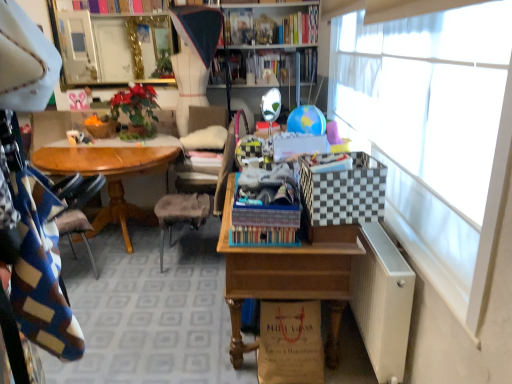
Question: From a real-world perspective, is hardcover books at upper center, which is the 1th book from top to bottom, positioned above or below white sheer curtain at right?

Choices:
 (A) above
 (B) below

Answer: (A)

Question: In the image, is hardcover books at upper center, the first book from the right, positioned in front of or behind white sheer curtain at right?

Choices:
 (A) front
 (B) behind

Answer: (B)

Question: Estimate the real-world distances between objects in this image. Which object is farther from the black and white checkered picnic basket at right?

Choices:
 (A) green leafy plant at center
 (B) hardcover book at upper center, which ranks as the first book in bottom-to-top order
 (C) burlap flowerpot at center
 (D) wooden desk at center
 (E) white sheer curtain at right

Answer: (B)

Question: Which of these objects is positioned farthest from the burlap flowerpot at center?

Choices:
 (A) black and white checkered picnic basket at right
 (B) hardcover book at upper center, arranged as the second book when viewed from the top
 (C) white sheer curtain at right
 (D) green leafy plant at center
 (E) hardcover books at upper center, acting as the 2th book starting from the left

Answer: (C)